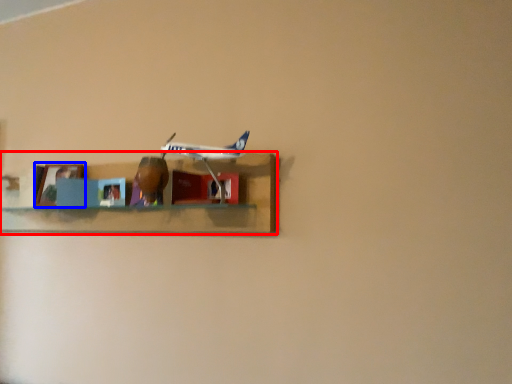
Question: Which object appears farthest to the camera in this image, shelf (highlighted by a red box) or picture frame (highlighted by a blue box)?

Choices:
 (A) shelf
 (B) picture frame

Answer: (B)